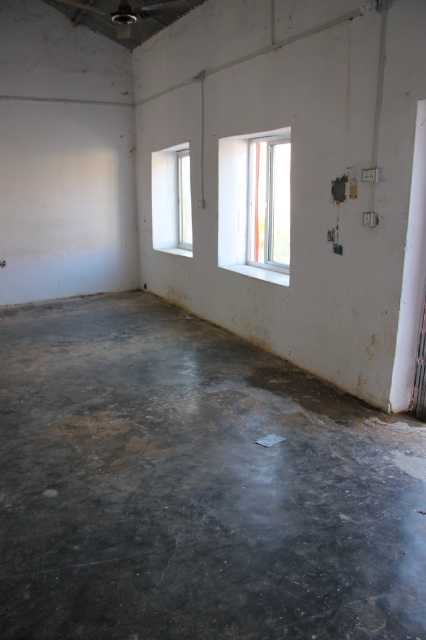
From the picture: You are standing in the unfinished room and want to place a small plant between the two points, point [123,307] and point [166,150]. Since you want the plant to be as close as possible to the camera, which point should you position it closer to?

To position the plant as close as possible to the camera, you should place it closer to point [123,307] since it is closer to the camera than point [166,150].

You are an interior designer planning to install a large rug in the room. The rug you have is the same size as the gray concrete floor at center. Will the rug cover the white plastic window at center completely?

The gray concrete floor at center is larger in size than the white plastic window at center, so the rug, being the same size as the gray concrete floor at center, will cover the white plastic window at center completely.